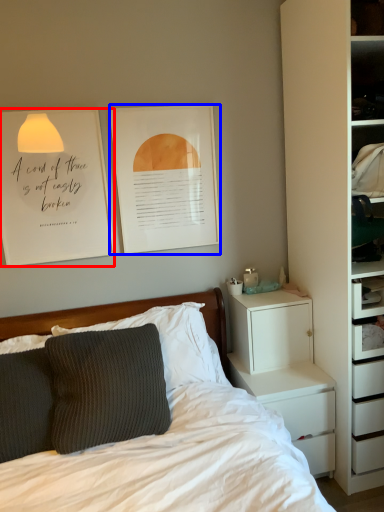
Question: Which point is further to the camera, bulletin board (highlighted by a red box) or picture frame (highlighted by a blue box)?

Choices:
 (A) bulletin board
 (B) picture frame

Answer: (B)